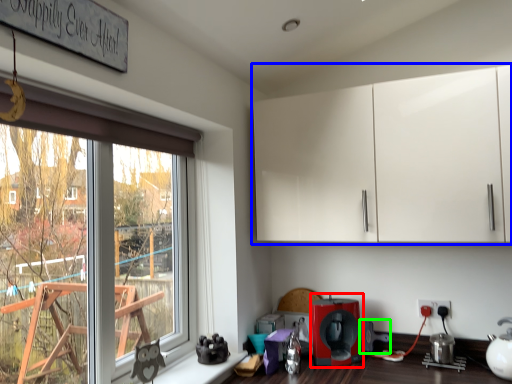
Question: Considering the real-world distances, which object is closest to coffee machine (highlighted by a red box)? cabinetry (highlighted by a blue box) or coffee machine (highlighted by a green box).

Choices:
 (A) cabinetry
 (B) coffee machine

Answer: (B)